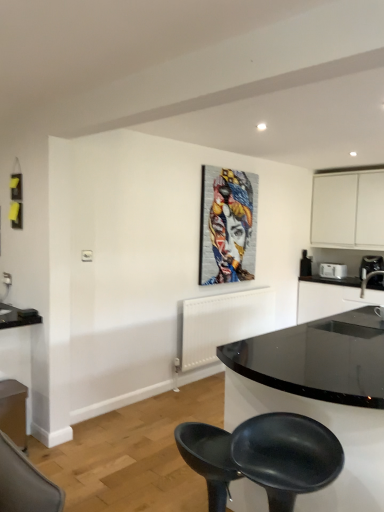
Question: Is black plastic toaster at upper right, the first appliance viewed from the left, positioned with its back to black glossy countertop at right?

Choices:
 (A) yes
 (B) no

Answer: (B)

Question: From the image's perspective, is black plastic toaster at upper right, placed as the second appliance when sorted from right to left, above black glossy countertop at right?

Choices:
 (A) yes
 (B) no

Answer: (A)

Question: Could you tell me if black plastic toaster at upper right, the first appliance viewed from the left, is facing black glossy countertop at right?

Choices:
 (A) no
 (B) yes

Answer: (A)

Question: Does black plastic toaster at upper right, placed as the second appliance when sorted from right to left, appear on the right side of black glossy countertop at right?

Choices:
 (A) yes
 (B) no

Answer: (B)

Question: Is black plastic toaster at upper right, the first appliance viewed from the left, outside black glossy countertop at right?

Choices:
 (A) no
 (B) yes

Answer: (B)

Question: Is black plastic toaster at upper right, placed as the second appliance when sorted from right to left, next to black glossy countertop at right and touching it?

Choices:
 (A) no
 (B) yes

Answer: (A)

Question: Does black plastic coffee machine at right lie in front of black plastic toaster at upper right, the first appliance viewed from the left?

Choices:
 (A) no
 (B) yes

Answer: (B)

Question: Can you confirm if black plastic coffee machine at right is thinner than black plastic toaster at upper right, placed as the second appliance when sorted from right to left?

Choices:
 (A) no
 (B) yes

Answer: (A)

Question: From the image's perspective, is black plastic coffee machine at right located beneath black plastic toaster at upper right, the first appliance viewed from the left?

Choices:
 (A) no
 (B) yes

Answer: (A)

Question: Can you confirm if black plastic coffee machine at right is bigger than black plastic toaster at upper right, the first appliance viewed from the left?

Choices:
 (A) yes
 (B) no

Answer: (A)

Question: Does black plastic coffee machine at right have a lesser height compared to black plastic toaster at upper right, the first appliance viewed from the left?

Choices:
 (A) yes
 (B) no

Answer: (B)

Question: Is black plastic coffee machine at right smaller than black plastic toaster at upper right, the first appliance viewed from the left?

Choices:
 (A) yes
 (B) no

Answer: (B)

Question: From a real-world perspective, is black glossy sink at right over black glossy countertop at right?

Choices:
 (A) no
 (B) yes

Answer: (B)